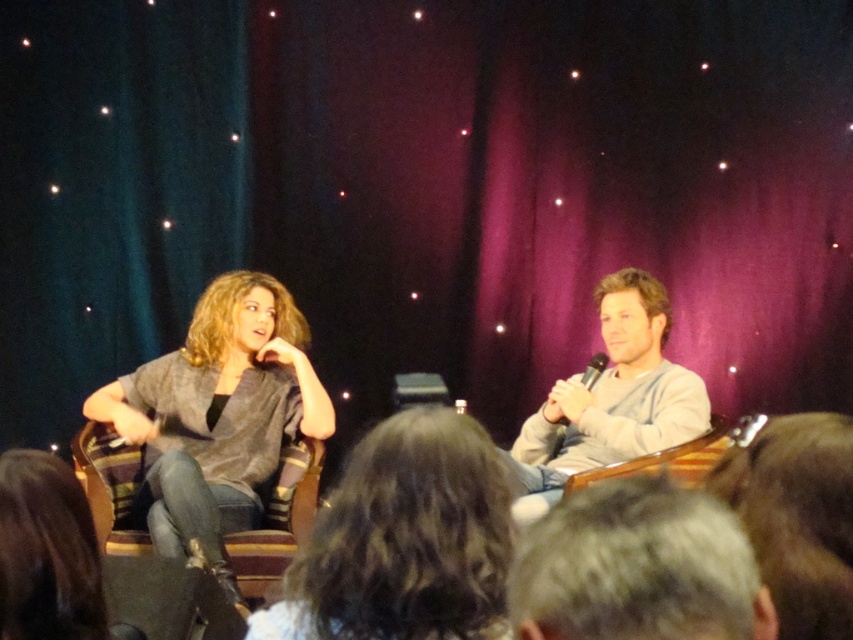
Question: Which point is closer to the camera?

Choices:
 (A) gray hair at center
 (B) black plastic microphone at center

Answer: (A)

Question: Estimate the real-world distances between objects in this image. Which object is farther from the black plastic microphone at center?

Choices:
 (A) gray hair at center
 (B) gray sweater at center
 (C) gray cotton shirt at right
 (D) gray fabric shirt at left

Answer: (A)

Question: Can you confirm if gray fabric shirt at left is bigger than gray hair at center?

Choices:
 (A) yes
 (B) no

Answer: (A)

Question: Does gray fabric shirt at left lie in front of black plastic microphone at center?

Choices:
 (A) no
 (B) yes

Answer: (B)

Question: Which point appears farthest from the camera in this image?

Choices:
 (A) (403, 477)
 (B) (601, 333)
 (C) (585, 378)
 (D) (641, 524)

Answer: (B)

Question: Is gray sweater at center wider than gray fabric shirt at left?

Choices:
 (A) yes
 (B) no

Answer: (B)